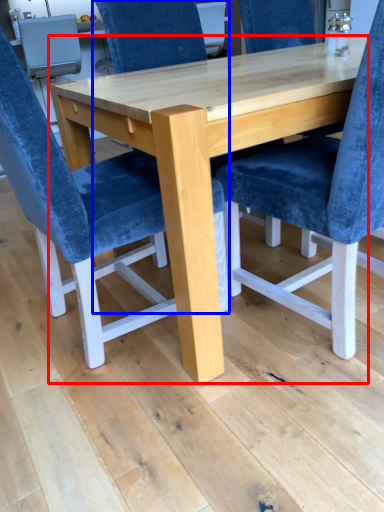
Question: Which object is further to the camera taking this photo, table (highlighted by a red box) or chair (highlighted by a blue box)?

Choices:
 (A) table
 (B) chair

Answer: (B)